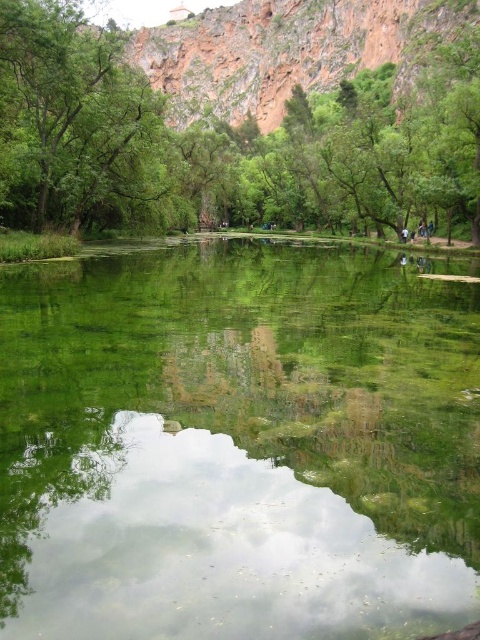
Question: Which point is farther to the camera?

Choices:
 (A) (4, 38)
 (B) (432, 552)
 (C) (66, 131)

Answer: (C)

Question: Is green leafy tree at center further to camera compared to green leafy tree at upper left?

Choices:
 (A) no
 (B) yes

Answer: (B)

Question: Can you confirm if green reflective water at center is positioned below green leafy tree at center?

Choices:
 (A) no
 (B) yes

Answer: (B)

Question: Estimate the real-world distances between objects in this image. Which object is farther from the green leafy tree at upper left?

Choices:
 (A) green reflective water at center
 (B) green leafy tree at center

Answer: (B)

Question: Does green reflective water at center appear over green leafy tree at upper left?

Choices:
 (A) yes
 (B) no

Answer: (B)

Question: Which object is farther from the camera taking this photo?

Choices:
 (A) green leafy tree at upper left
 (B) green reflective water at center
 (C) green leafy tree at center

Answer: (C)